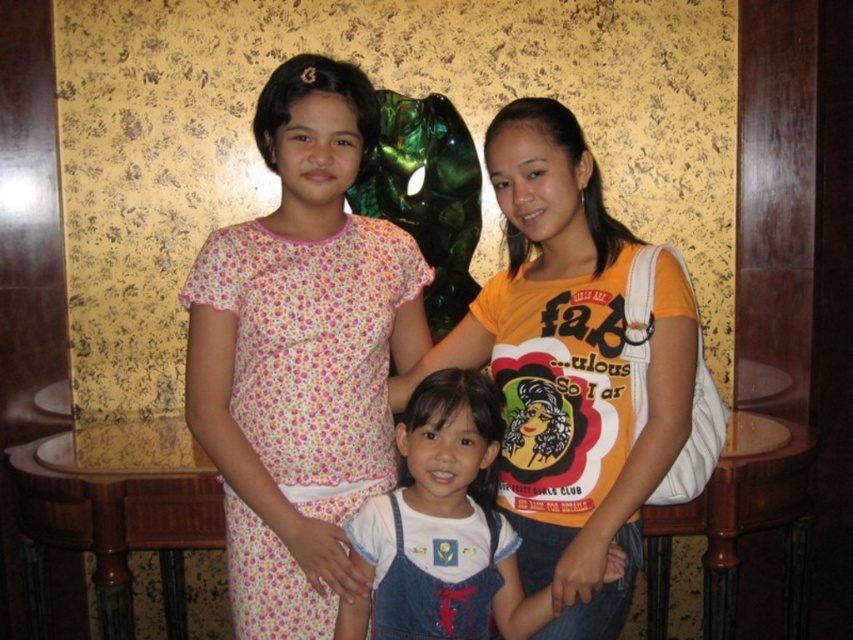
Question: Does orange cotton t-shirt at center have a smaller size compared to white denim overalls at center?

Choices:
 (A) no
 (B) yes

Answer: (A)

Question: Can you confirm if orange cotton t-shirt at center is positioned to the right of white denim overalls at center?

Choices:
 (A) no
 (B) yes

Answer: (B)

Question: Which of the following is the closest to the observer?

Choices:
 (A) (463, 556)
 (B) (550, 541)
 (C) (376, 380)

Answer: (A)

Question: Which point is closer to the camera?

Choices:
 (A) floral cotton dress at center
 (B) white denim overalls at center
 (C) orange cotton t-shirt at center

Answer: (C)

Question: Does floral cotton dress at center appear on the left side of white denim overalls at center?

Choices:
 (A) no
 (B) yes

Answer: (B)

Question: Considering the real-world distances, which object is closest to the floral cotton dress at center?

Choices:
 (A) orange cotton t-shirt at center
 (B) white denim overalls at center

Answer: (B)